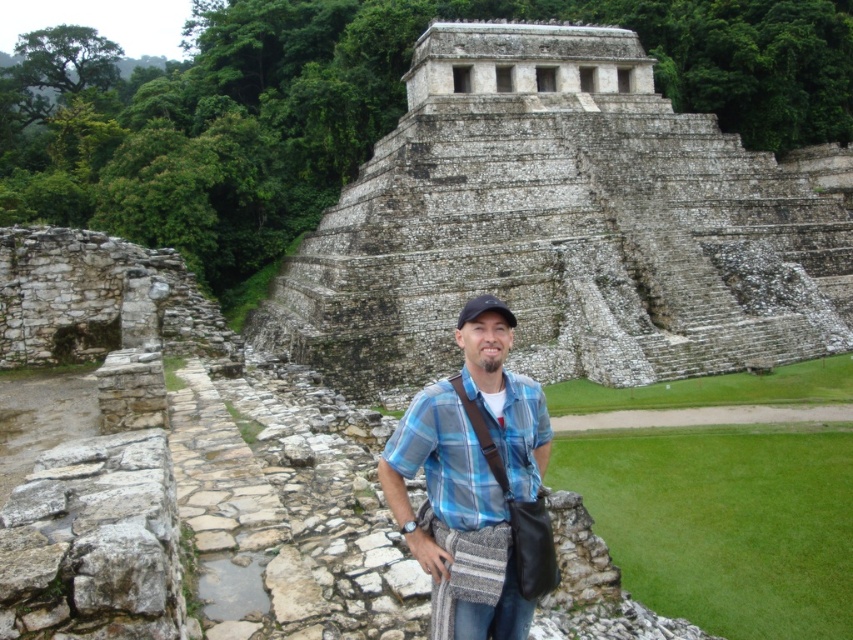
Which is in front, point (628, 172) or point (445, 545)?

Point (445, 545) is more forward.

Describe the element at coordinates (561, 227) in the screenshot. I see `stone textured pyramid at center` at that location.

Which is behind, point (605, 140) or point (492, 413)?

The point (605, 140) is more distant.

Where is `stone textured pyramid at center`? stone textured pyramid at center is located at coordinates (561, 227).